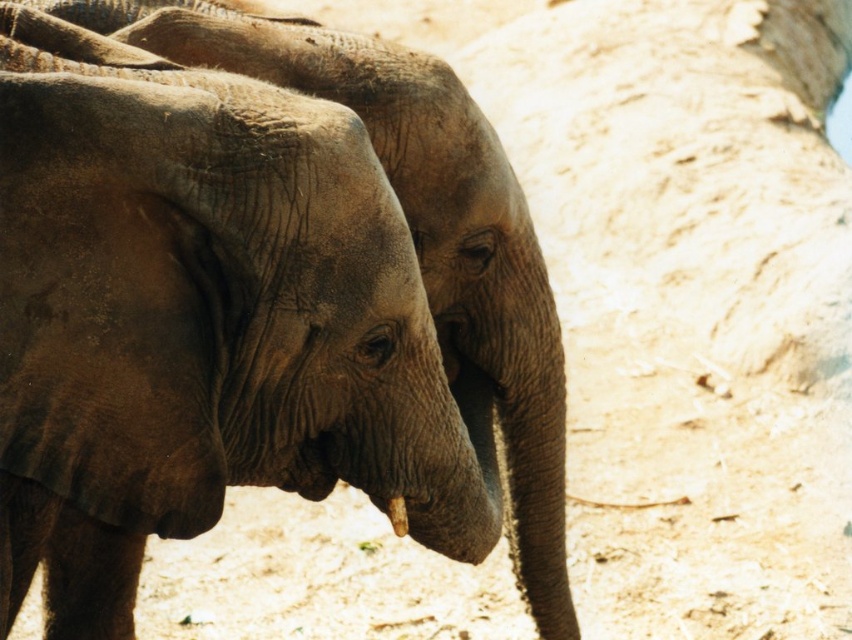
Question: Does gray textured elephant at center appear under white matte tusk at lower center?

Choices:
 (A) yes
 (B) no

Answer: (B)

Question: Among these points, which one is nearest to the camera?

Choices:
 (A) (406, 534)
 (B) (465, 125)

Answer: (A)

Question: In this image, where is gray textured elephant at center located relative to white matte tusk at lower center?

Choices:
 (A) below
 (B) above

Answer: (B)

Question: Which point is farther from the camera taking this photo?

Choices:
 (A) (396, 516)
 (B) (85, 10)

Answer: (B)

Question: Can you confirm if gray textured elephant at center is positioned to the left of white matte tusk at lower center?

Choices:
 (A) no
 (B) yes

Answer: (A)